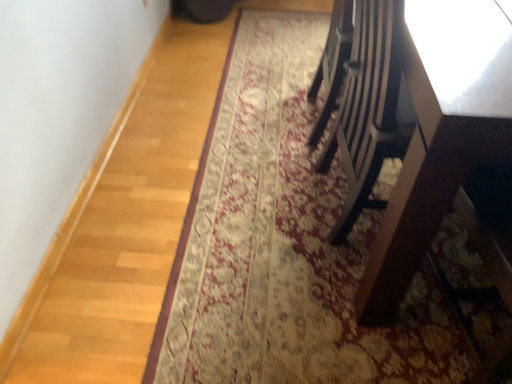
Where is `vacant space to the left of wooden chair at right`? The image size is (512, 384). vacant space to the left of wooden chair at right is located at coordinates (260, 169).